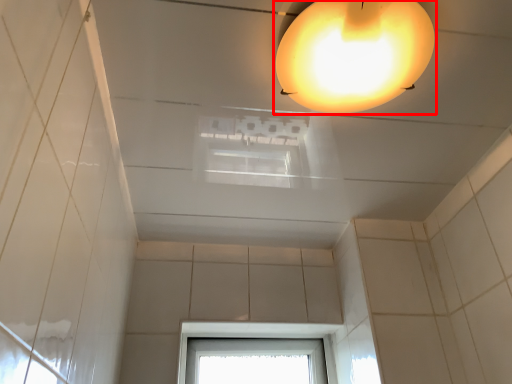
Question: From the image's perspective, what is the correct spatial positioning of lamp (annotated by the red box) in reference to window?

Choices:
 (A) below
 (B) above

Answer: (B)